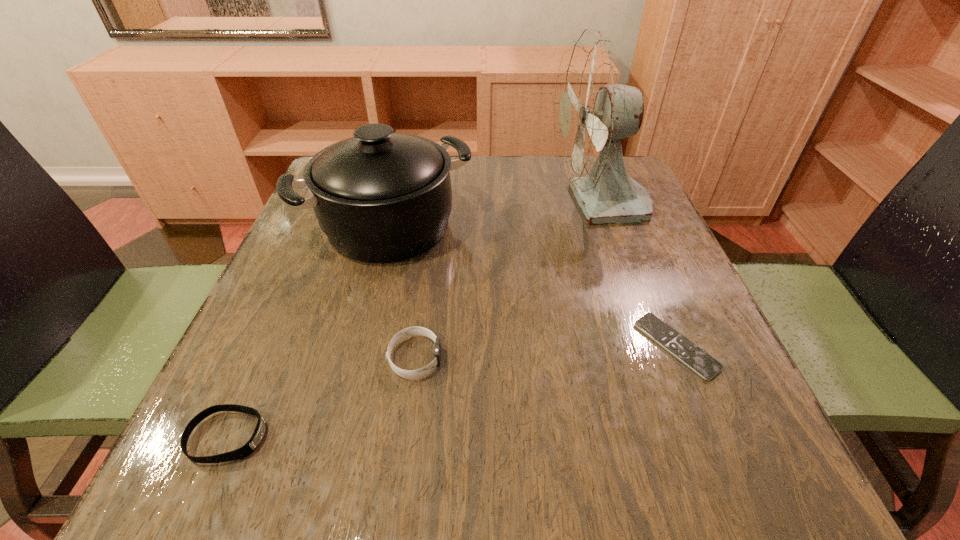
The image size is (960, 540). I want to click on free space that is in between the tallest object and the remote control, so click(638, 275).

You are a GUI agent. You are given a task and a screenshot of the screen. Output one action in this format:
    pyautogui.click(x=<x>, y=<y>)
    Task: Click on the free space between the farther wristband and the left wristband
    The width and height of the screenshot is (960, 540).
    Given the screenshot: What is the action you would take?
    pyautogui.click(x=322, y=397)

The width and height of the screenshot is (960, 540). In order to click on empty location between the tallest object and the shorter wristband in this screenshot , I will do pyautogui.click(x=414, y=321).

The image size is (960, 540). Find the location of `free space between the remote control and the second shortest object`. free space between the remote control and the second shortest object is located at coordinates (452, 392).

At what (x,y) coordinates should I click in order to perform the action: click on free space between the tallest object and the remote control. Please return your answer as a coordinate pair (x, y). This screenshot has height=540, width=960. Looking at the image, I should click on (638, 275).

Where is `vacant region between the nearer wristband and the remote control`? vacant region between the nearer wristband and the remote control is located at coordinates (452, 392).

Where is `free spot between the remote control and the farther wristband`? This screenshot has width=960, height=540. free spot between the remote control and the farther wristband is located at coordinates (545, 352).

Where is `free area in between the saucepan and the fan`? The height and width of the screenshot is (540, 960). free area in between the saucepan and the fan is located at coordinates (494, 215).

This screenshot has height=540, width=960. I want to click on free point between the shortest object and the third tallest object, so click(545, 352).

Identify the location of object that can be found as the closest to the remote control. (593, 110).